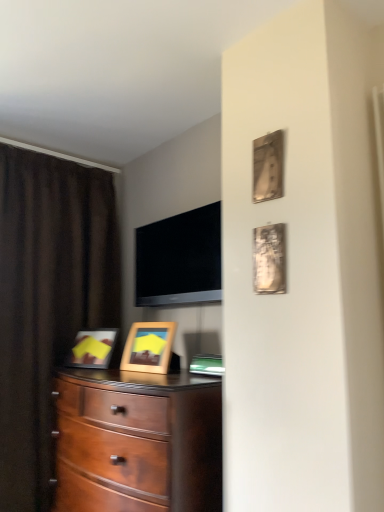
Question: Considering the relative sizes of wooden picture frame at center, acting as the third picture frame starting from the front, and brown fabric curtain at left in the image provided, is wooden picture frame at center, acting as the third picture frame starting from the front, shorter than brown fabric curtain at left?

Choices:
 (A) yes
 (B) no

Answer: (A)

Question: Is wooden picture frame at center, acting as the third picture frame starting from the front, beside brown fabric curtain at left?

Choices:
 (A) yes
 (B) no

Answer: (B)

Question: Could you tell me if wooden picture frame at center, arranged as the 3th picture frame when viewed from the right, is facing brown fabric curtain at left?

Choices:
 (A) no
 (B) yes

Answer: (A)

Question: Considering the relative sizes of wooden picture frame at center, the 3th picture frame viewed from the top, and brown fabric curtain at left in the image provided, is wooden picture frame at center, the 3th picture frame viewed from the top, thinner than brown fabric curtain at left?

Choices:
 (A) yes
 (B) no

Answer: (A)

Question: Is wooden picture frame at center, arranged as the 3th picture frame when viewed from the right, positioned behind brown fabric curtain at left?

Choices:
 (A) yes
 (B) no

Answer: (A)

Question: From the image's perspective, is wooden picture frame at center, which appears as the first picture frame when viewed from the back, on top of brown fabric curtain at left?

Choices:
 (A) yes
 (B) no

Answer: (B)

Question: Is metallic silver picture frame at upper right, which is the second picture frame in front-to-back order, inside wooden picture frame at center, the first picture frame ordered from the bottom?

Choices:
 (A) yes
 (B) no

Answer: (B)

Question: From the image's perspective, is wooden picture frame at center, acting as the third picture frame starting from the front, below metallic silver picture frame at upper right, which is the second picture frame in front-to-back order?

Choices:
 (A) yes
 (B) no

Answer: (A)

Question: Can you confirm if wooden picture frame at center, which is the first picture frame from left to right, is taller than metallic silver picture frame at upper right, the first picture frame in the top-to-bottom sequence?

Choices:
 (A) no
 (B) yes

Answer: (B)

Question: From a real-world perspective, is wooden picture frame at center, acting as the third picture frame starting from the front, physically above metallic silver picture frame at upper right, which is the second picture frame in front-to-back order?

Choices:
 (A) yes
 (B) no

Answer: (B)

Question: Does wooden picture frame at center, which appears as the first picture frame when viewed from the back, lie in front of metallic silver picture frame at upper right, acting as the second picture frame starting from the back?

Choices:
 (A) no
 (B) yes

Answer: (A)

Question: Is wooden picture frame at center, which appears as the first picture frame when viewed from the back, at the right side of metallic silver picture frame at upper right, which is counted as the third picture frame, starting from the bottom?

Choices:
 (A) yes
 (B) no

Answer: (B)

Question: Is mahogany wood dresser at center to the right of flat screen tv at upper center from the viewer's perspective?

Choices:
 (A) no
 (B) yes

Answer: (A)